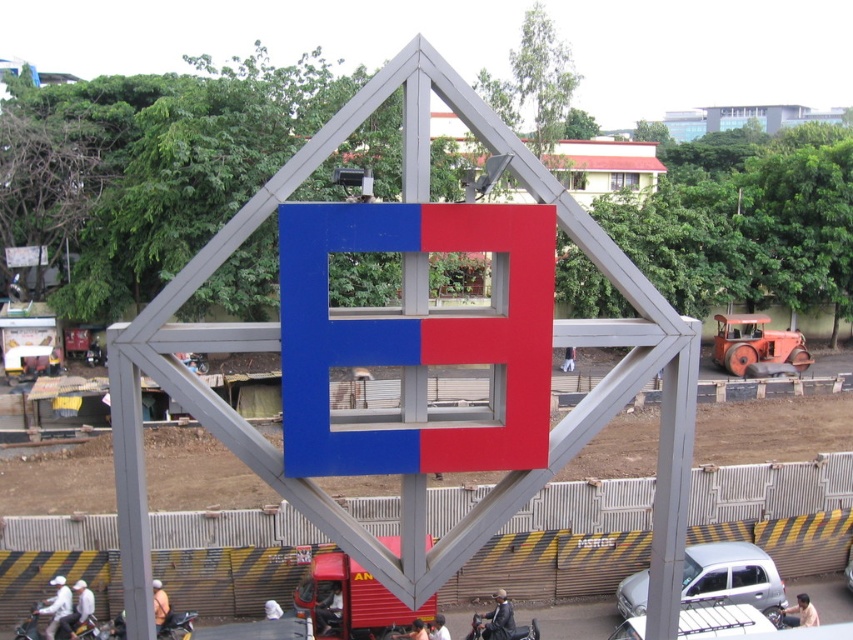
You are standing in front of the large geometric structure and see a point marked at coordinates [415,336]. What object is located at that point?

The point at coordinates [415,336] indicates the location of the blue matte sign at center.